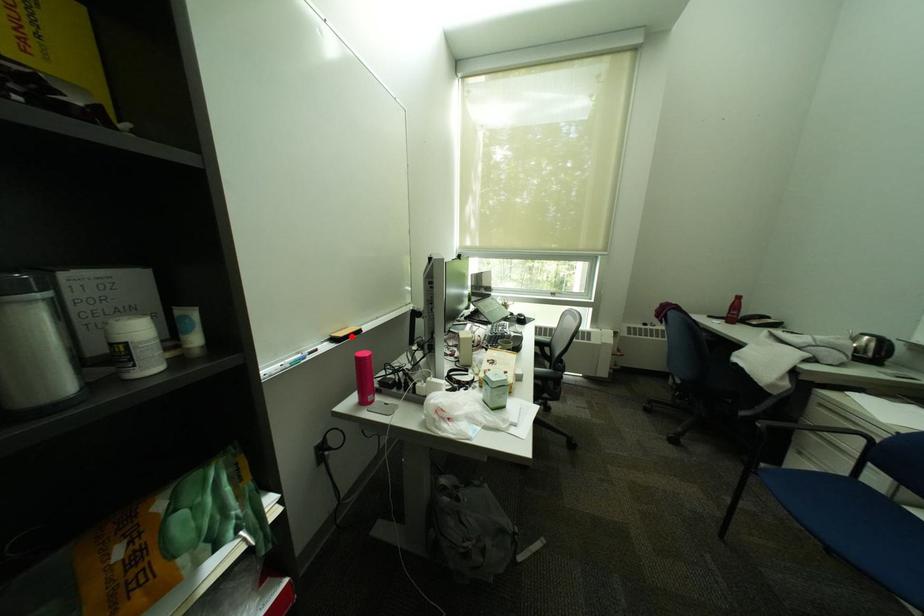
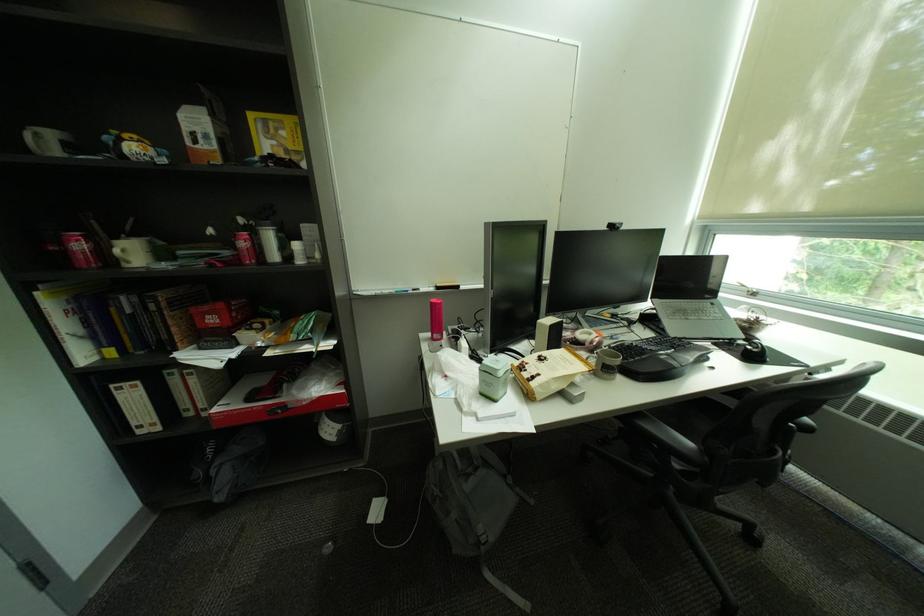
Where in the second image is the point corresponding to the highlighted location from the first image?

(450, 286)